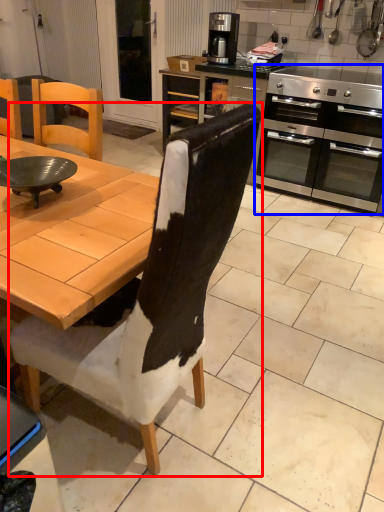
Question: Among these objects, which one is farthest to the camera, chair (highlighted by a red box) or kitchen appliance (highlighted by a blue box)?

Choices:
 (A) chair
 (B) kitchen appliance

Answer: (B)